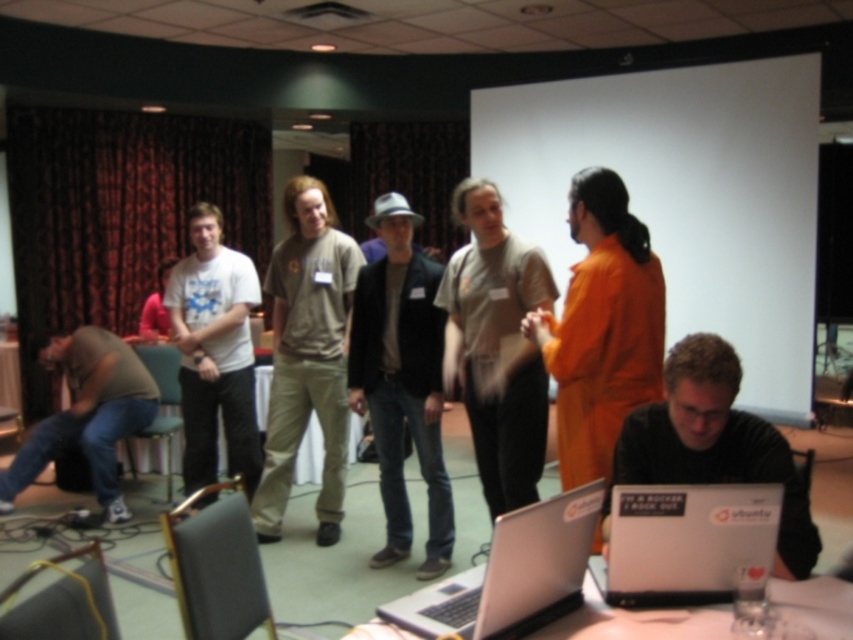
Question: Which object is farther from the camera taking this photo?

Choices:
 (A) matte khaki pants at center
 (B) white matte t-shirt at center
 (C) silver metallic laptop at lower center

Answer: (B)

Question: Does white matte t-shirt at center have a lesser width compared to white glossy table at lower center?

Choices:
 (A) no
 (B) yes

Answer: (B)

Question: Considering the real-world distances, which object is farthest from the silver metallic laptop at lower center?

Choices:
 (A) white glossy table at lower center
 (B) matte brown shirt at lower left
 (C) gray fabric shirt at center
 (D) white matte t-shirt at center

Answer: (B)

Question: Can you confirm if matte khaki pants at center is wider than black matte laptop at lower right?

Choices:
 (A) yes
 (B) no

Answer: (A)

Question: Which point appears closest to the camera in this image?

Choices:
 (A) (598, 612)
 (B) (662, 353)
 (C) (531, 508)
 (D) (791, 484)

Answer: (C)

Question: In this image, where is black matte laptop at lower right located relative to white glossy table at lower center?

Choices:
 (A) left
 (B) right

Answer: (B)